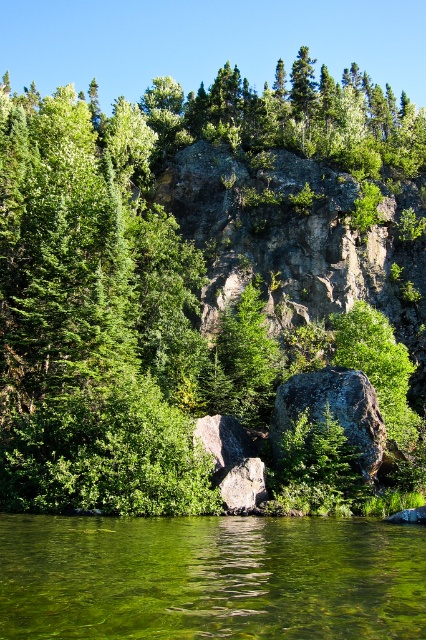
Question: Considering the relative positions of green leafy tree at center and green translucent water at lower center in the image provided, where is green leafy tree at center located with respect to green translucent water at lower center?

Choices:
 (A) above
 (B) below

Answer: (A)

Question: Can you confirm if green leafy tree at center is smaller than green translucent water at lower center?

Choices:
 (A) yes
 (B) no

Answer: (B)

Question: From the image, what is the correct spatial relationship of green leafy tree at center in relation to green translucent water at lower center?

Choices:
 (A) left
 (B) right

Answer: (A)